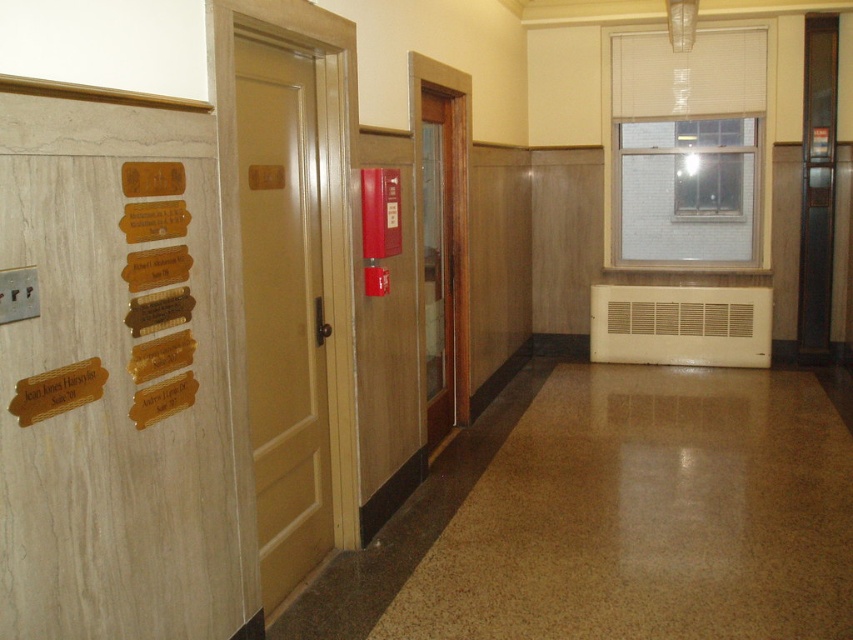
Is matte wood door at center behind gold polished wood nameplates at left?

Yes.

How much distance is there between matte wood door at center and gold polished wood nameplates at left?

A distance of 26.27 inches exists between matte wood door at center and gold polished wood nameplates at left.

What do you see at coordinates (283, 310) in the screenshot?
I see `matte wood door at center` at bounding box center [283, 310].

You are a GUI agent. You are given a task and a screenshot of the screen. Output one action in this format:
    pyautogui.click(x=<x>, y=<y>)
    Task: Click on the matte wood door at center
    The image size is (853, 640).
    Given the screenshot: What is the action you would take?
    [x=283, y=310]

Between gold polished wood nameplates at left and wooden door at center, which one appears on the left side from the viewer's perspective?

From the viewer's perspective, gold polished wood nameplates at left appears more on the left side.

Which is below, gold polished wood nameplates at left or wooden door at center?

gold polished wood nameplates at left is lower down.

This screenshot has height=640, width=853. What do you see at coordinates (157, 289) in the screenshot? I see `gold polished wood nameplates at left` at bounding box center [157, 289].

Where is `gold polished wood nameplates at left`? The height and width of the screenshot is (640, 853). gold polished wood nameplates at left is located at coordinates (157, 289).

Who is higher up, matte wood door at center or wooden door at center?

wooden door at center

Who is positioned more to the right, matte wood door at center or wooden door at center?

wooden door at center is more to the right.

You are a GUI agent. You are given a task and a screenshot of the screen. Output one action in this format:
    pyautogui.click(x=<x>, y=<y>)
    Task: Click on the matte wood door at center
    The image size is (853, 640).
    Given the screenshot: What is the action you would take?
    pyautogui.click(x=283, y=310)